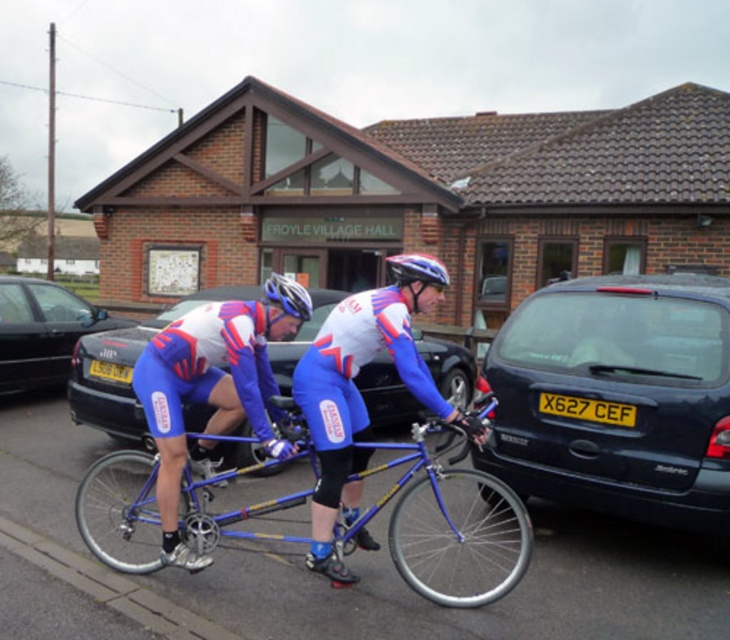
You are a photographer standing in front of Froyle Village Hall. You want to take a photo of the white matte bicycle helmet at center without including the black metallic car at left in the frame. Based on their positions, is this possible?

The black metallic car at left is below the white matte bicycle helmet at center, so if you position your camera to aim higher, you can capture the white matte bicycle helmet at center while excluding the black metallic car at left from the lower part of the frame.

You are standing at the origin point of the coordinate system in the image. The image has a coordinate system where the bottom left corner is the origin. You want to move towards the blue metallic tandem bicycle at center. In which direction should you move first?

Since the blue metallic tandem bicycle at center is located at coordinate point (445,522), you should first move towards the right and up from the origin point to reach it.